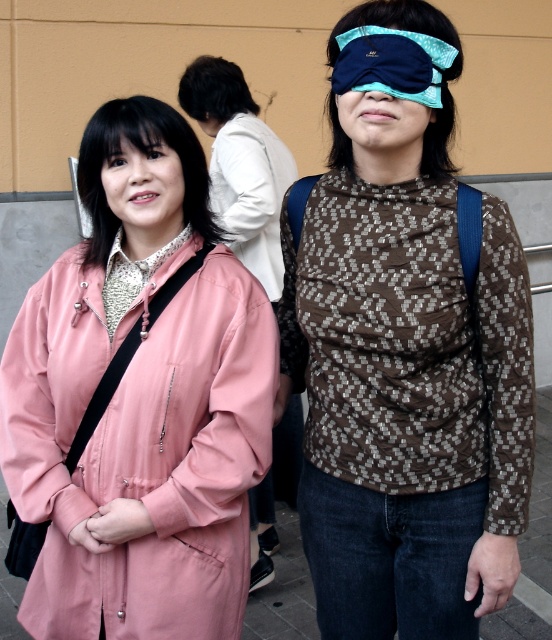
Question: Which object appears farthest from the camera in this image?

Choices:
 (A) matte pink coat at left
 (B) pink matte jacket at left

Answer: (B)

Question: Can you confirm if pink fabric coat at left is positioned below blue fabric blindfold at upper center?

Choices:
 (A) no
 (B) yes

Answer: (B)

Question: Observing the image, what is the correct spatial positioning of pink fabric coat at left in reference to matte blue fabric eye mask at center?

Choices:
 (A) above
 (B) below

Answer: (B)

Question: Which object is positioned farthest from the dark brown hair at upper center?

Choices:
 (A) blue fabric blindfold at upper center
 (B) matte blue fabric eye mask at center
 (C) brown textured jacket at center
 (D) pink matte jacket at left

Answer: (C)

Question: Among these objects, which one is farthest from the camera?

Choices:
 (A) pink matte jacket at left
 (B) pink fabric coat at left
 (C) dark brown hair at upper center
 (D) blue fabric blindfold at upper center

Answer: (C)

Question: From the image, what is the correct spatial relationship of brown textured jacket at center in relation to matte blue fabric eye mask at center?

Choices:
 (A) left
 (B) right

Answer: (B)